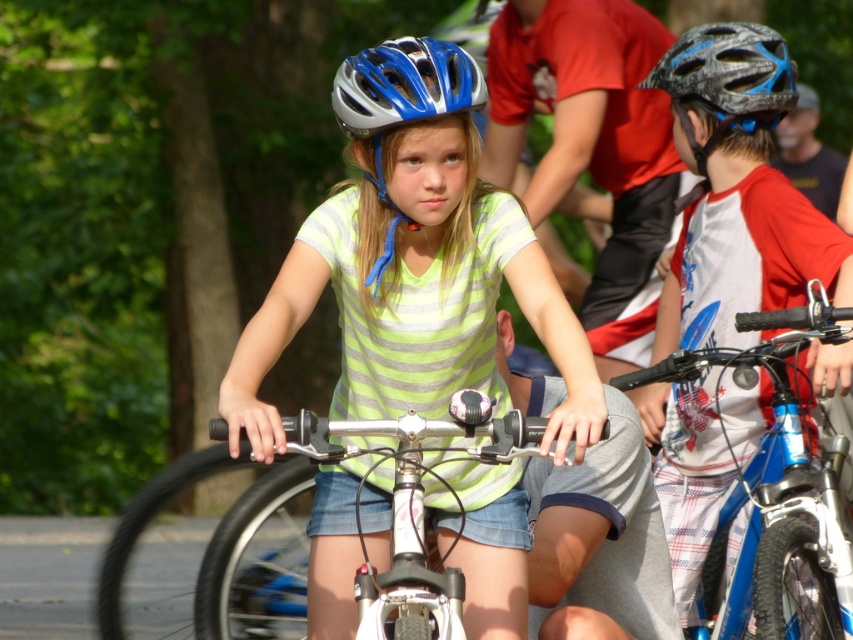
You are standing at the center of the park and see the point marked at coordinates (401,104). What object is this point located on?

The point marked at coordinates (401,104) is located on the matte silver helmet at center.

You are a parent trying to choose a helmet for your child from the two available in the image. The shiny blue helmet at right and the matte black helmet at upper right. Based on their sizes, which one would you recommend?

The shiny blue helmet at right has a larger size compared to matte black helmet at upper right, so I would recommend the shiny blue helmet at right for your child as it offers a better fit and comfort.

You are a photographer trying to capture a clear shot of both the shiny blue helmet at right and the matte black helmet at upper right. Which helmet should you adjust your focus to first to ensure it appears sharp in the photo?

The shiny blue helmet at right is in front of the matte black helmet at upper right, so you should focus on the shiny blue helmet at right first to ensure it is sharp, and the matte black helmet at upper right will naturally be in focus if the depth of field is sufficient.